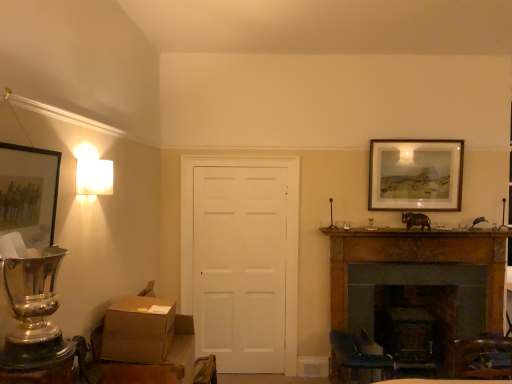
Describe the element at coordinates (417, 260) in the screenshot. I see `wooden fireplace at lower right` at that location.

Describe the element at coordinates (92, 172) in the screenshot. This screenshot has width=512, height=384. I see `white matte square lamp at upper left` at that location.

This screenshot has height=384, width=512. Describe the element at coordinates (29, 192) in the screenshot. I see `matte black picture frame at left, which ranks as the first picture frame in left-to-right order` at that location.

You are a GUI agent. You are given a task and a screenshot of the screen. Output one action in this format:
    pyautogui.click(x=<x>, y=<y>)
    Task: Click on the wooden fireplace at lower right
    This screenshot has height=384, width=512.
    Given the screenshot: What is the action you would take?
    pyautogui.click(x=417, y=260)

Is matte black picture frame at left, which ranks as the first picture frame in left-to-right order, behind brown cardboard box at lower left?

That is False.

Is matte black picture frame at left, placed as the 2th picture frame when sorted from right to left, wider or thinner than brown cardboard box at lower left?

Considering their sizes, matte black picture frame at left, placed as the 2th picture frame when sorted from right to left, looks slimmer than brown cardboard box at lower left.

Locate an element on the screen. This screenshot has height=384, width=512. box lying below the matte black picture frame at left, acting as the first picture frame starting from the front (from the image's perspective) is located at coordinates (138, 330).

Looking at this image, does brown cardboard box at lower left have a larger size compared to matte black picture frame at left, placed as the 2th picture frame when sorted from right to left?

Correct, brown cardboard box at lower left is larger in size than matte black picture frame at left, placed as the 2th picture frame when sorted from right to left.

Considering the sizes of objects brown cardboard box at lower left and matte black picture frame at left, arranged as the second picture frame when viewed from the back, in the image provided, who is wider, brown cardboard box at lower left or matte black picture frame at left, arranged as the second picture frame when viewed from the back,?

brown cardboard box at lower left.

Looking at this image, from a real-world perspective, is brown cardboard box at lower left over matte black picture frame at left, which ranks as the first picture frame in left-to-right order?

Actually, brown cardboard box at lower left is physically below matte black picture frame at left, which ranks as the first picture frame in left-to-right order, in the real world.

Is brown cardboard box at lower left to the right of matte black picture frame at left, acting as the first picture frame starting from the front, from the viewer's perspective?

Correct, you'll find brown cardboard box at lower left to the right of matte black picture frame at left, acting as the first picture frame starting from the front.

Could white matte square lamp at upper left be considered to be inside matte black picture frame at left, placed as the 2th picture frame when sorted from right to left?

No, white matte square lamp at upper left is located outside of matte black picture frame at left, placed as the 2th picture frame when sorted from right to left.

From a real-world perspective, is matte black picture frame at left, acting as the first picture frame starting from the front, physically below white matte square lamp at upper left?

Indeed, from a real-world perspective, matte black picture frame at left, acting as the first picture frame starting from the front, is positioned beneath white matte square lamp at upper left.

Is point (57, 163) positioned in front of point (106, 168)?

Yes.

Does brown cardboard box at lower left have a larger size compared to white matte square lamp at upper left?

Correct, brown cardboard box at lower left is larger in size than white matte square lamp at upper left.

Which of these two, brown cardboard box at lower left or white matte square lamp at upper left, stands shorter?

Standing shorter between the two is white matte square lamp at upper left.

Where is `lamp in front of the brown cardboard box at lower left`? The height and width of the screenshot is (384, 512). lamp in front of the brown cardboard box at lower left is located at coordinates (92, 172).

Looking at this image, from a real-world perspective, is brown cardboard box at lower left below white matte square lamp at upper left?

Correct, in the physical world, brown cardboard box at lower left is lower than white matte square lamp at upper left.

Is wooden fireplace at lower right next to white matte square lamp at upper left and touching it?

No.

In the scene shown: In the image, is wooden fireplace at lower right on the left side or the right side of white matte square lamp at upper left?

wooden fireplace at lower right is positioned on white matte square lamp at upper left's right side.

From the image's perspective, relative to white matte square lamp at upper left, is wooden fireplace at lower right above or below?

wooden fireplace at lower right is situated lower than white matte square lamp at upper left in the image.

Is wooden fireplace at lower right aimed at white matte square lamp at upper left?

No, wooden fireplace at lower right does not turn towards white matte square lamp at upper left.

Between brown cardboard box at lower left and wooden fireplace at lower right, which one has less height?

brown cardboard box at lower left.

Is brown cardboard box at lower left next to wooden fireplace at lower right?

No, brown cardboard box at lower left is not making contact with wooden fireplace at lower right.

Is brown cardboard box at lower left situated inside wooden fireplace at lower right or outside?

brown cardboard box at lower left is not enclosed by wooden fireplace at lower right.

From a real-world perspective, between brown cardboard box at lower left and wooden fireplace at lower right, who is vertically higher?

From a 3D spatial view, brown cardboard box at lower left is above.

What's the angular difference between matte black picture frame at left, acting as the first picture frame starting from the front, and white matte door at center's facing directions?

matte black picture frame at left, acting as the first picture frame starting from the front, and white matte door at center are facing 86.5 degrees away from each other.

Is matte black picture frame at left, arranged as the second picture frame when viewed from the back, to the left of white matte door at center from the viewer's perspective?

Indeed, matte black picture frame at left, arranged as the second picture frame when viewed from the back, is positioned on the left side of white matte door at center.

From the image's perspective, which object appears higher, matte black picture frame at left, which ranks as the first picture frame in left-to-right order, or white matte door at center?

matte black picture frame at left, which ranks as the first picture frame in left-to-right order, from the image's perspective.

Is there a large distance between matte black picture frame at left, placed as the 2th picture frame when sorted from right to left, and white matte door at center?

Yes, matte black picture frame at left, placed as the 2th picture frame when sorted from right to left, and white matte door at center are located far from each other.

The width and height of the screenshot is (512, 384). I want to click on picture frame located in front of the brown cardboard box at lower left, so click(29, 192).

This screenshot has width=512, height=384. What are the coordinates of `the 1st picture frame positioned above the brown cardboard box at lower left (from the image's perspective)` in the screenshot? It's located at (29, 192).

Looking at the image, which one is located closer to wooden fireplace at lower right, white matte square lamp at upper left or matte black picture frame at left, placed as the 2th picture frame when sorted from right to left?

The object closer to wooden fireplace at lower right is white matte square lamp at upper left.

Based on the photo, when comparing their distances from brown cardboard box at lower left, does white matte door at center or white matte square lamp at upper left seem further?

white matte door at center is further to brown cardboard box at lower left.

Estimate the real-world distances between objects in this image. Which object is closer to white matte door at center, wooden picture frame at upper right, which is counted as the 2th picture frame, starting from the left, or wooden fireplace at lower right?

wooden fireplace at lower right is positioned closer to the anchor white matte door at center.

When comparing their distances from matte black picture frame at left, placed as the 2th picture frame when sorted from right to left, does brown cardboard box at lower left or wooden fireplace at lower right seem further?

wooden fireplace at lower right.

Based on their spatial positions, is matte black picture frame at left, arranged as the second picture frame when viewed from the back, or white matte square lamp at upper left further from wooden picture frame at upper right, which is the 1th picture frame from right to left?

matte black picture frame at left, arranged as the second picture frame when viewed from the back, lies further to wooden picture frame at upper right, which is the 1th picture frame from right to left, than the other object.

When comparing their distances from white matte door at center, does matte black picture frame at left, which ranks as the first picture frame in left-to-right order, or wooden picture frame at upper right, which is counted as the 2th picture frame, starting from the left, seem closer?

wooden picture frame at upper right, which is counted as the 2th picture frame, starting from the left, is closer to white matte door at center.

Considering their positions, is white matte door at center positioned further to wooden fireplace at lower right than matte black picture frame at left, which ranks as the first picture frame in left-to-right order?

matte black picture frame at left, which ranks as the first picture frame in left-to-right order, lies further to wooden fireplace at lower right than the other object.

When comparing their distances from matte black picture frame at left, acting as the first picture frame starting from the front, does brown cardboard box at lower left or white matte square lamp at upper left seem further?

brown cardboard box at lower left.

Identify the location of box between white matte square lamp at upper left and wooden picture frame at upper right, the second picture frame viewed from the front. (138, 330).

At what (x,y) coordinates should I click in order to perform the action: click on fireplace between brown cardboard box at lower left and wooden picture frame at upper right, which is counted as the 2th picture frame, starting from the left. Please return your answer as a coordinate pair (x, y). The width and height of the screenshot is (512, 384). Looking at the image, I should click on (417, 260).

Find the location of `door between white matte square lamp at upper left and wooden fireplace at lower right from left to right`. door between white matte square lamp at upper left and wooden fireplace at lower right from left to right is located at coordinates (249, 239).

Where is `door located between brown cardboard box at lower left and wooden picture frame at upper right, the second picture frame viewed from the front, in the left-right direction`? This screenshot has height=384, width=512. door located between brown cardboard box at lower left and wooden picture frame at upper right, the second picture frame viewed from the front, in the left-right direction is located at coordinates (249, 239).